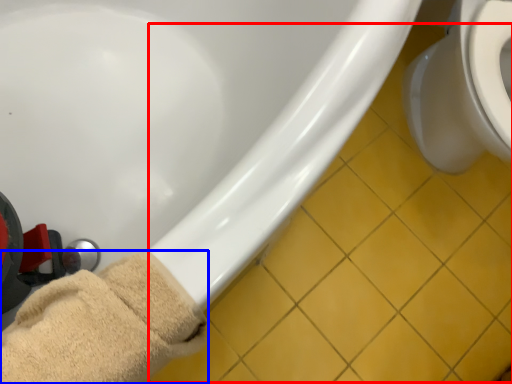
Question: Which object appears farthest to the camera in this image, tile (highlighted by a red box) or towel (highlighted by a blue box)?

Choices:
 (A) tile
 (B) towel

Answer: (A)